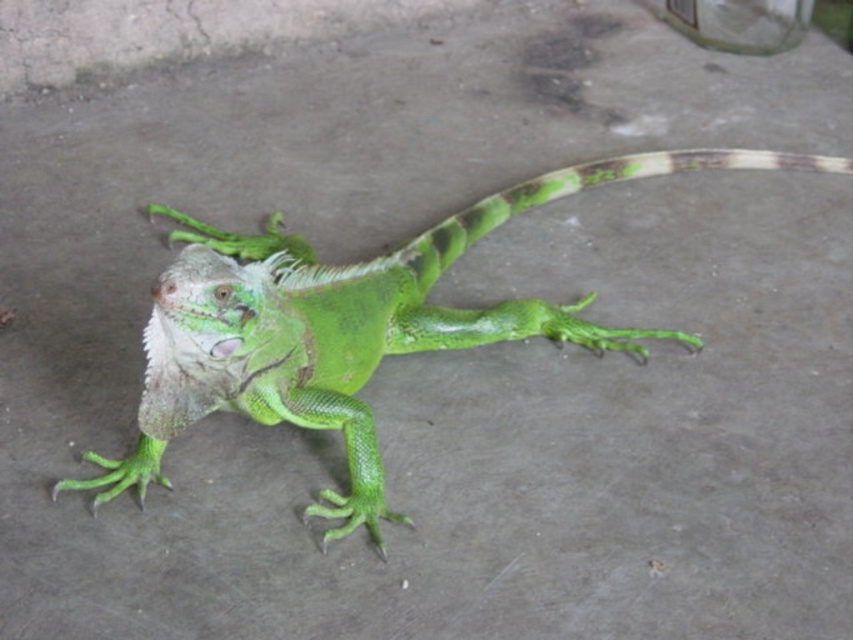
You are a wildlife photographer trying to capture a closeup of the green matte lizard at center and the green scaly tail at center. Your camera has a 5 inch focus range. Can you focus on both subjects simultaneously?

The green matte lizard at center is 6.35 inches from the green scaly tail at center, which exceeds the camera focus range of 5 inches. Therefore, you cannot focus on both subjects simultaneously.

You are a photographer trying to capture the green matte lizard at center and the green scaly tail at center in the same frame. Based on their positions, which direction should you move your camera to include both in the shot?

Since the green matte lizard at center is to the left of the green scaly tail at center, you should move your camera to the left to include both the green matte lizard at center and the green scaly tail at center in the frame.